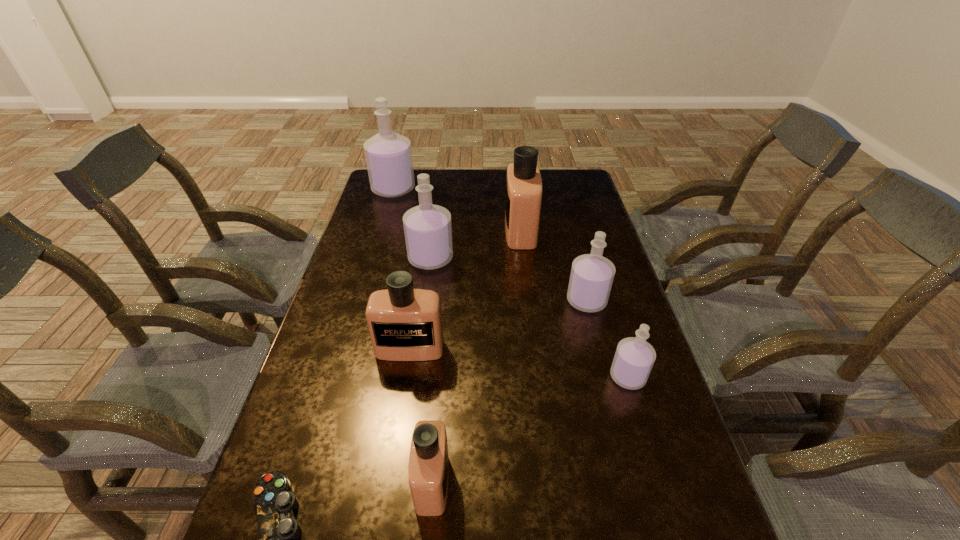
Identify which purple perfume is the nearest to the shortest object. Please provide its 2D coordinates. Your answer should be formatted as a tuple, i.e. [(x, y)], where the tuple contains the x and y coordinates of a point satisfying the conditions above.

[(428, 232)]

Locate which beige perfume is the second closest to the nearest perfume. Please provide its 2D coordinates. Your answer should be formatted as a tuple, i.e. [(x, y)], where the tuple contains the x and y coordinates of a point satisfying the conditions above.

[(523, 199)]

Identify which beige perfume is the third closest to the third smallest purple perfume. Please provide its 2D coordinates. Your answer should be formatted as a tuple, i.e. [(x, y)], where the tuple contains the x and y coordinates of a point satisfying the conditions above.

[(428, 468)]

Find the location of `free space that satisfies the following two spatial constraints: 1. on the front label of the nearest purple perfume; 2. on the right side of the second smallest beige perfume`. free space that satisfies the following two spatial constraints: 1. on the front label of the nearest purple perfume; 2. on the right side of the second smallest beige perfume is located at coordinates (405, 377).

In order to click on vacant area in the image that satisfies the following two spatial constraints: 1. on the front label of the biggest beige perfume; 2. on the back side of the second smallest purple perfume in this screenshot , I will do `click(529, 301)`.